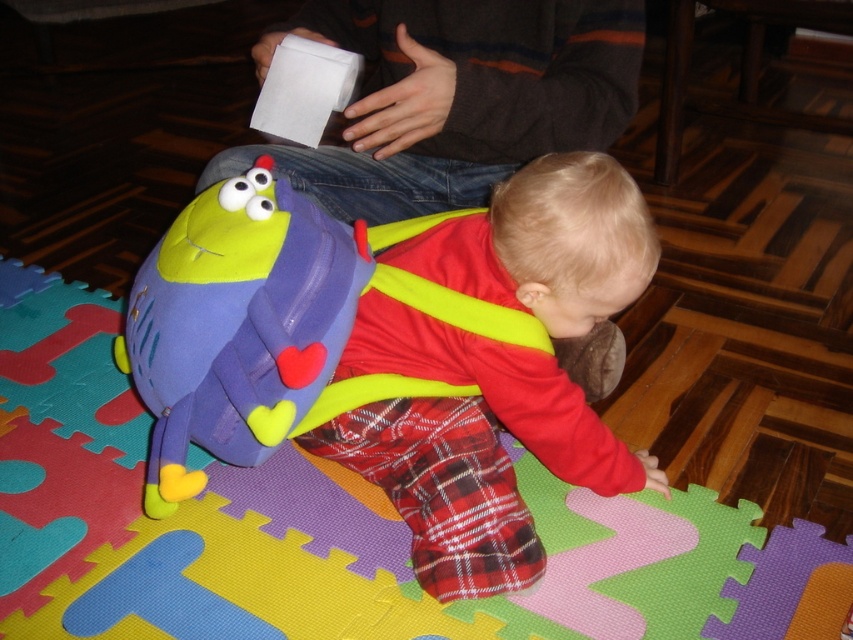
You are a photographer trying to capture a shot of the child and their belongings. You want to ensure both the red plaid pants at center and the matte purple backpack at lower left are visible in the frame. Based on their positions, which object should you focus on first to include both in the photo?

The red plaid pants at center is located below the matte purple backpack at lower left, so focusing on the matte purple backpack at lower left first will ensure both objects are in the frame since the pants are positioned lower down.

From the picture: You are a photographer setting up for a family photo. You have two points marked in the scene that you need to focus on. The first point is at coordinates point (553, 380) and the second point is at coordinates point (149, 512). Which point should you focus on first to ensure the subject closest to the camera is in focus?

Point (553, 380) is further to the camera than point (149, 512), so you should focus on point (553, 380) first to ensure the subject closest to the camera is in focus.